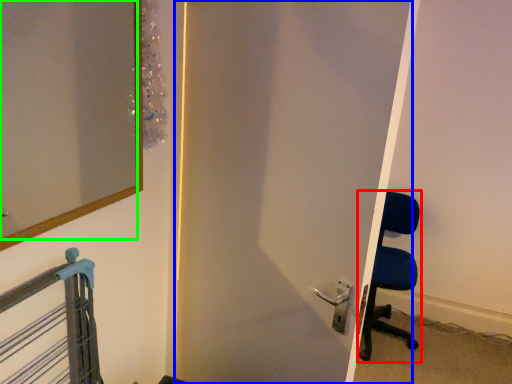
Question: Considering the real-world distances, which object is farthest from chair (highlighted by a red box)? door (highlighted by a blue box) or mirror (highlighted by a green box)?

Choices:
 (A) door
 (B) mirror

Answer: (B)